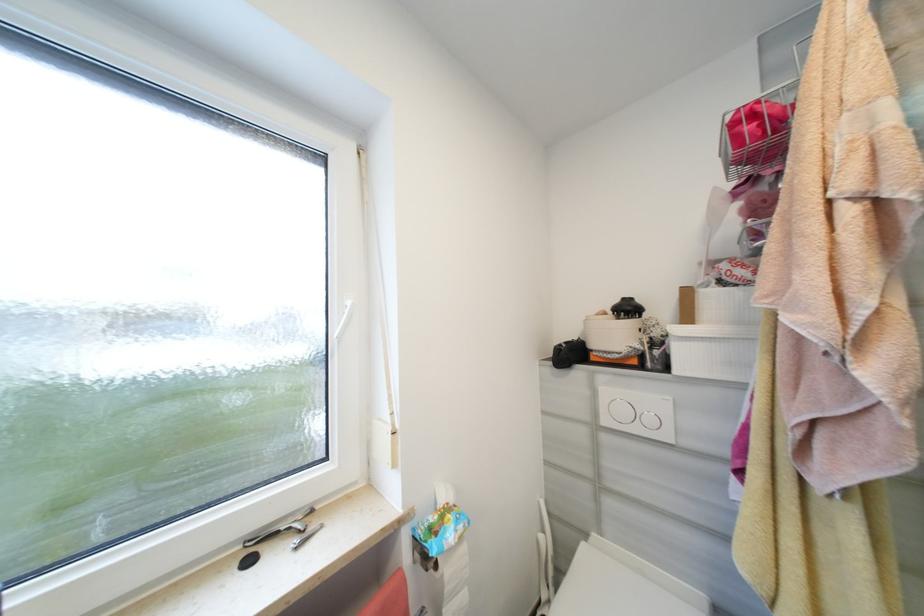
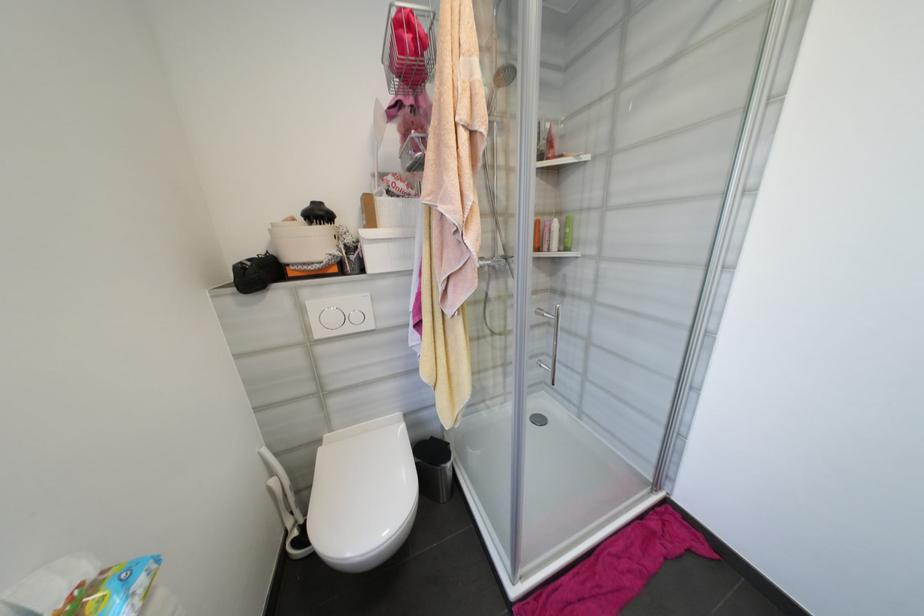
The point at (546, 537) is marked in the first image. Where is the corresponding point in the second image?

(277, 482)